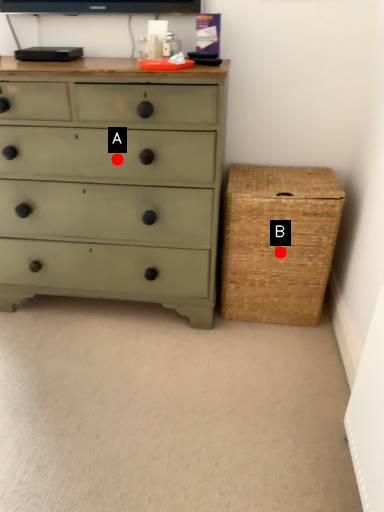
Question: Two points are circled on the image, labeled by A and B beside each circle. Which point appears closest to the camera in this image?

Choices:
 (A) A is closer
 (B) B is closer

Answer: (A)